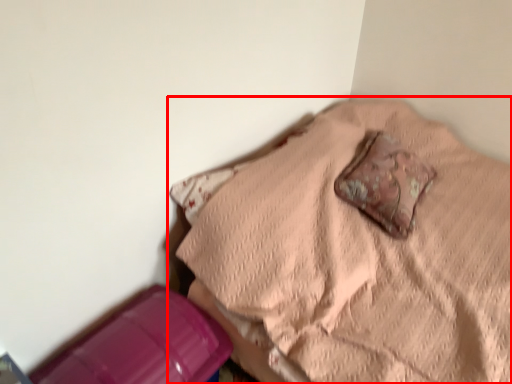
Question: In this image, where is furniture (annotated by the red box) located relative to pillow?

Choices:
 (A) left
 (B) right

Answer: (A)